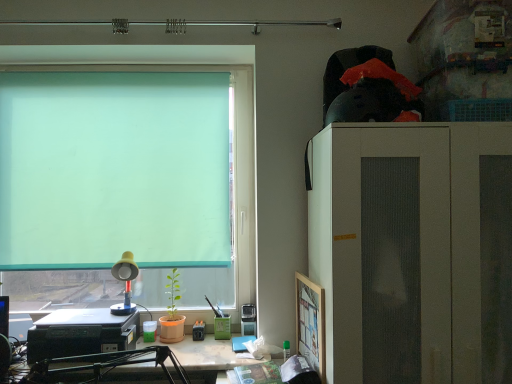
Question: Is matte black printer at lower left taller than white matte cabinet at right?

Choices:
 (A) no
 (B) yes

Answer: (A)

Question: Does matte black printer at lower left lie in front of white matte cabinet at right?

Choices:
 (A) yes
 (B) no

Answer: (B)

Question: Considering the relative positions of matte black printer at lower left and white matte cabinet at right in the image provided, is matte black printer at lower left to the left of white matte cabinet at right from the viewer's perspective?

Choices:
 (A) yes
 (B) no

Answer: (A)

Question: Considering the relative positions of matte black printer at lower left and white matte cabinet at right in the image provided, is matte black printer at lower left to the right of white matte cabinet at right from the viewer's perspective?

Choices:
 (A) no
 (B) yes

Answer: (A)

Question: Is matte black printer at lower left outside of white matte cabinet at right?

Choices:
 (A) no
 (B) yes

Answer: (B)

Question: Considering the relative sizes of matte black printer at lower left and white matte cabinet at right in the image provided, is matte black printer at lower left wider than white matte cabinet at right?

Choices:
 (A) yes
 (B) no

Answer: (B)

Question: Can you confirm if white matte cabinet at right is shorter than yellow plastic lamp at lower left?

Choices:
 (A) yes
 (B) no

Answer: (B)

Question: Could you tell me if white matte cabinet at right is turned towards yellow plastic lamp at lower left?

Choices:
 (A) no
 (B) yes

Answer: (A)

Question: Is white matte cabinet at right positioned beyond the bounds of yellow plastic lamp at lower left?

Choices:
 (A) yes
 (B) no

Answer: (A)

Question: From a real-world perspective, is white matte cabinet at right below yellow plastic lamp at lower left?

Choices:
 (A) yes
 (B) no

Answer: (B)

Question: Does white matte cabinet at right lie behind yellow plastic lamp at lower left?

Choices:
 (A) no
 (B) yes

Answer: (A)

Question: Considering the relative positions of white matte cabinet at right and yellow plastic lamp at lower left in the image provided, is white matte cabinet at right to the right of yellow plastic lamp at lower left from the viewer's perspective?

Choices:
 (A) yes
 (B) no

Answer: (A)

Question: Can you confirm if black plastic printer at lower left is bigger than matte black printer at lower left?

Choices:
 (A) no
 (B) yes

Answer: (B)